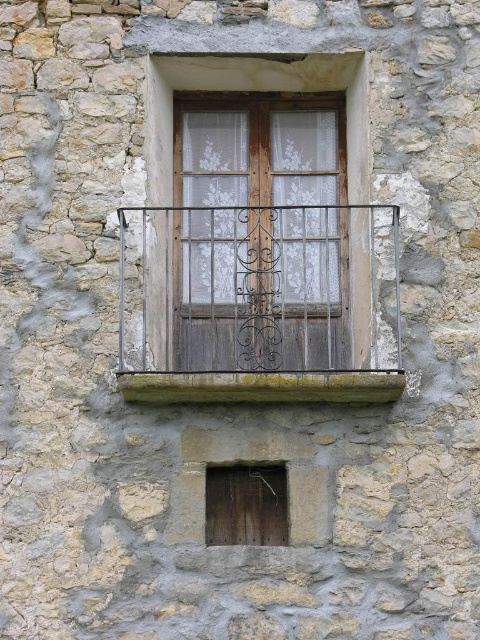
Which is more to the left, wooden frame at center or green mossy wood at lower center?

wooden frame at center is more to the left.

Is point (155, 54) behind point (256, 397)?

Yes, point (155, 54) is behind point (256, 397).

Which is behind, point (179, 68) or point (129, 396)?

The point (179, 68) is behind.

This screenshot has height=640, width=480. Find the location of `wooden frame at center`. wooden frame at center is located at coordinates (252, 90).

Between dark brown wrought iron balcony at center and wooden door at lower center, which one appears on the left side from the viewer's perspective?

wooden door at lower center is more to the left.

Between point (214, 384) and point (218, 531), which one is positioned in front?

Point (214, 384)

Measure the distance between dark brown wrought iron balcony at center and camera.

dark brown wrought iron balcony at center and camera are 27.59 meters apart.

Find the location of a particular element. This screenshot has height=640, width=480. dark brown wrought iron balcony at center is located at coordinates (260, 304).

Is wooden frame at center smaller than wooden door at lower center?

Actually, wooden frame at center might be larger than wooden door at lower center.

Who is higher up, wooden frame at center or wooden door at lower center?

wooden frame at center is higher up.

Which is behind, point (264, 67) or point (236, 532)?

The point (264, 67) is behind.

Find the location of a particular element. wooden frame at center is located at coordinates (252, 90).